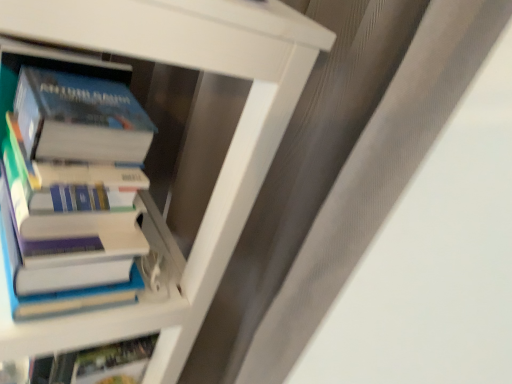
This screenshot has height=384, width=512. Describe the element at coordinates (132, 172) in the screenshot. I see `hardcover book at left, acting as the 2th book starting from the top` at that location.

This screenshot has height=384, width=512. I want to click on hardcover book at left, acting as the 2th book starting from the top, so click(132, 172).

The image size is (512, 384). What do you see at coordinates (71, 232) in the screenshot?
I see `hardcover books at left, which is the 1th book in top-to-bottom order` at bounding box center [71, 232].

In order to face hardcover books at left, the 2th book when ordered from bottom to top, should I rotate leftwards or rightwards?

Rotate left and turn 21.554 degrees.

Locate an element on the screen. This screenshot has width=512, height=384. hardcover books at left, which is the 1th book in top-to-bottom order is located at coordinates (71, 232).

In order to click on hardcover book at left, arranged as the 1th book when ordered from the bottom in this screenshot , I will do `click(132, 172)`.

Can you confirm if hardcover book at left, arranged as the 1th book when ordered from the bottom, is positioned to the right of hardcover books at left, the 2th book when ordered from bottom to top?

No.

From the picture: Is hardcover book at left, arranged as the 1th book when ordered from the bottom, further to the viewer compared to hardcover books at left, which is the 1th book in top-to-bottom order?

No, it is in front of hardcover books at left, which is the 1th book in top-to-bottom order.

Is point (232, 47) closer or farther from the camera than point (42, 99)?

Point (232, 47) is closer to the camera than point (42, 99).

From the image's perspective, is hardcover book at left, arranged as the 1th book when ordered from the bottom, on top of hardcover books at left, which is the 1th book in top-to-bottom order?

No, from the image's perspective, hardcover book at left, arranged as the 1th book when ordered from the bottom, is not above hardcover books at left, which is the 1th book in top-to-bottom order.

From a real-world perspective, who is located lower, hardcover book at left, acting as the 2th book starting from the top, or hardcover books at left, which is the 1th book in top-to-bottom order?

hardcover book at left, acting as the 2th book starting from the top, is physically lower.

Does hardcover book at left, acting as the 2th book starting from the top, have a greater width compared to hardcover books at left, which is the 1th book in top-to-bottom order?

Correct, the width of hardcover book at left, acting as the 2th book starting from the top, exceeds that of hardcover books at left, which is the 1th book in top-to-bottom order.

Is hardcover book at left, acting as the 2th book starting from the top, taller than hardcover books at left, the 2th book when ordered from bottom to top?

Yes.

Which of these two, hardcover book at left, acting as the 2th book starting from the top, or hardcover books at left, which is the 1th book in top-to-bottom order, is bigger?

hardcover book at left, acting as the 2th book starting from the top.

Would you say hardcover book at left, acting as the 2th book starting from the top, is outside hardcover books at left, the 2th book when ordered from bottom to top?

Yes, hardcover book at left, acting as the 2th book starting from the top, is located beyond the bounds of hardcover books at left, the 2th book when ordered from bottom to top.

Is hardcover book at left, arranged as the 1th book when ordered from the bottom, touching hardcover books at left, the 2th book when ordered from bottom to top?

Yes, hardcover book at left, arranged as the 1th book when ordered from the bottom, is beside hardcover books at left, the 2th book when ordered from bottom to top.

Is hardcover book at left, acting as the 2th book starting from the top, turned away from hardcover books at left, the 2th book when ordered from bottom to top?

Yes, hardcover book at left, acting as the 2th book starting from the top, is positioned with its back facing hardcover books at left, the 2th book when ordered from bottom to top.

How different are the orientations of hardcover book at left, acting as the 2th book starting from the top, and hardcover books at left, which is the 1th book in top-to-bottom order, in degrees?

The facing directions of hardcover book at left, acting as the 2th book starting from the top, and hardcover books at left, which is the 1th book in top-to-bottom order, are 5.72e-05 degrees apart.

Find the location of a particular element. The height and width of the screenshot is (384, 512). book in front of the hardcover books at left, which is the 1th book in top-to-bottom order is located at coordinates (132, 172).

Which is more to the left, hardcover books at left, the 2th book when ordered from bottom to top, or hardcover book at left, arranged as the 1th book when ordered from the bottom?

hardcover book at left, arranged as the 1th book when ordered from the bottom.

Which object is closer to the camera, hardcover books at left, the 2th book when ordered from bottom to top, or hardcover book at left, acting as the 2th book starting from the top?

hardcover book at left, acting as the 2th book starting from the top, is in front.

Which point is more distant from viewer, (34,228) or (76,201)?

The point (34,228) is behind.

From the image's perspective, which is below, hardcover books at left, which is the 1th book in top-to-bottom order, or hardcover book at left, acting as the 2th book starting from the top?

hardcover book at left, acting as the 2th book starting from the top, from the image's perspective.

From a real-world perspective, between hardcover books at left, the 2th book when ordered from bottom to top, and hardcover book at left, acting as the 2th book starting from the top, who is vertically higher?

hardcover books at left, the 2th book when ordered from bottom to top.

Which of these two, hardcover books at left, the 2th book when ordered from bottom to top, or hardcover book at left, acting as the 2th book starting from the top, is wider?

hardcover book at left, acting as the 2th book starting from the top, is wider.

Which of these two, hardcover books at left, the 2th book when ordered from bottom to top, or hardcover book at left, acting as the 2th book starting from the top, stands shorter?

Standing shorter between the two is hardcover books at left, the 2th book when ordered from bottom to top.

Can you confirm if hardcover books at left, which is the 1th book in top-to-bottom order, is bigger than hardcover book at left, acting as the 2th book starting from the top?

Incorrect, hardcover books at left, which is the 1th book in top-to-bottom order, is not larger than hardcover book at left, acting as the 2th book starting from the top.

Can we say hardcover books at left, which is the 1th book in top-to-bottom order, lies outside hardcover book at left, arranged as the 1th book when ordered from the bottom?

Actually, hardcover books at left, which is the 1th book in top-to-bottom order, is at least partially inside hardcover book at left, arranged as the 1th book when ordered from the bottom.

Is hardcover books at left, the 2th book when ordered from bottom to top, beside hardcover book at left, acting as the 2th book starting from the top?

Yes, hardcover books at left, the 2th book when ordered from bottom to top, is next to hardcover book at left, acting as the 2th book starting from the top.

Is hardcover book at left, arranged as the 1th book when ordered from the bottom, at the back of hardcover books at left, the 2th book when ordered from bottom to top?

Correct, hardcover books at left, the 2th book when ordered from bottom to top, is looking away from hardcover book at left, arranged as the 1th book when ordered from the bottom.

In the image, there is a hardcover book at left, acting as the 2th book starting from the top. In order to click on book above it (from the image's perspective) in this screenshot , I will do `click(71, 232)`.

In order to click on book above the hardcover book at left, acting as the 2th book starting from the top (from a real-world perspective) in this screenshot , I will do `click(71, 232)`.

Image resolution: width=512 pixels, height=384 pixels. Find the location of `book above the hardcover book at left, acting as the 2th book starting from the top (from the image's perspective)`. book above the hardcover book at left, acting as the 2th book starting from the top (from the image's perspective) is located at coordinates (71, 232).